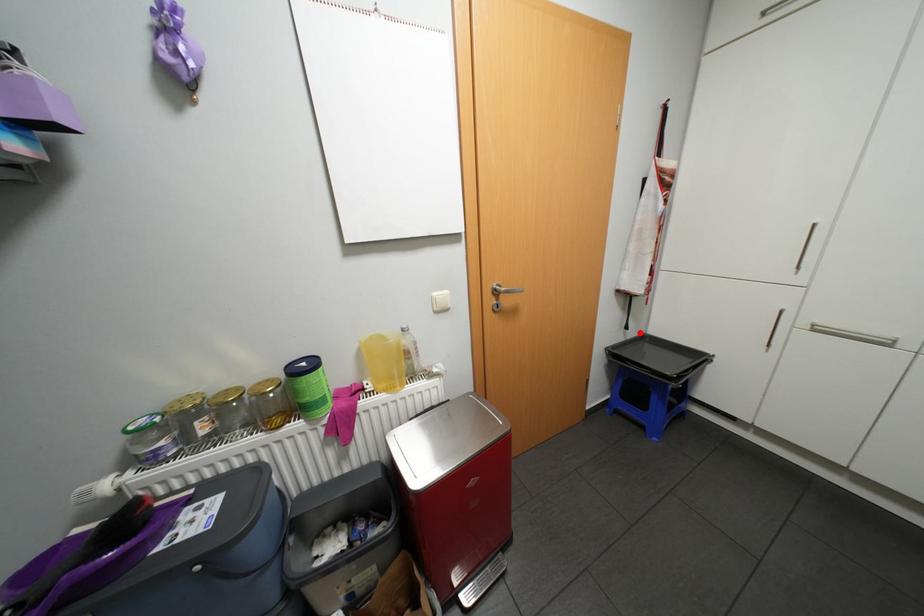
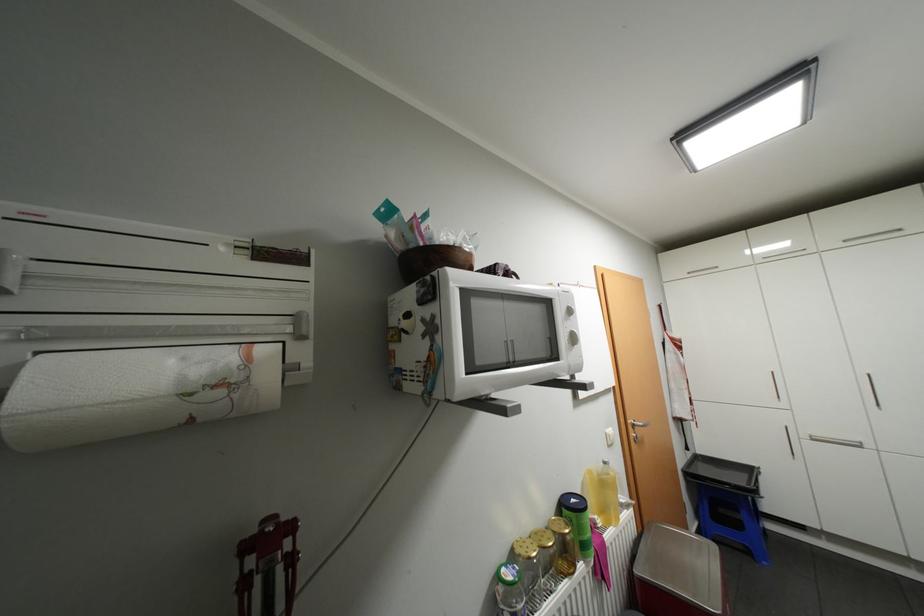
Find the pixel in the second image that matches the highlighted location in the first image.

(697, 453)